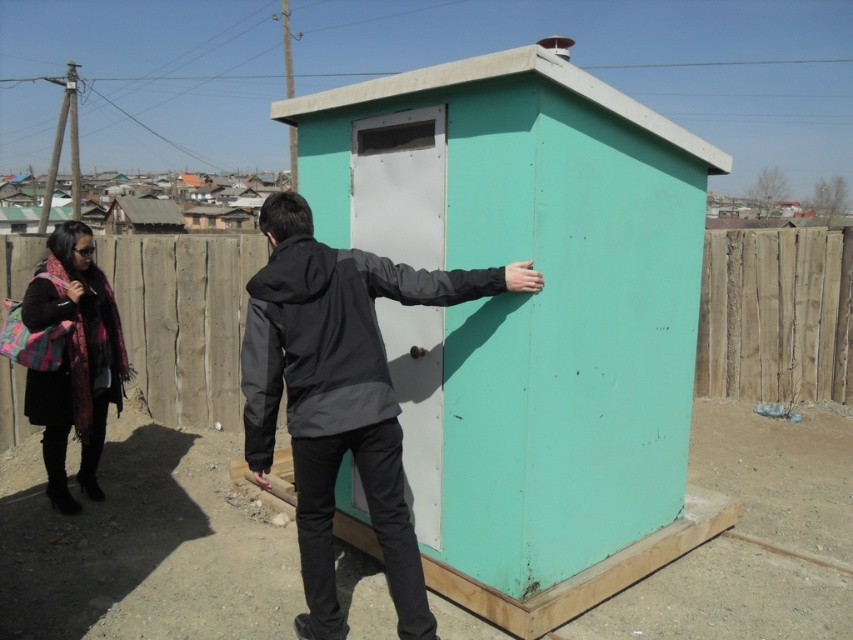
Question: Which of these objects is positioned closest to the teal matte shed at center?

Choices:
 (A) brown wooden fence at lower left
 (B) matte gray jacket at center
 (C) wooden fence at lower center
 (D) weathered wood fence at center

Answer: (B)

Question: Is matte gray jacket at center positioned before brown wooden fence at lower left?

Choices:
 (A) no
 (B) yes

Answer: (B)

Question: Which object appears closest to the camera in this image?

Choices:
 (A) matte gray jacket at center
 (B) wooden fence at lower center
 (C) teal matte shed at center
 (D) weathered wood fence at center

Answer: (A)

Question: Is the position of teal matte shed at center less distant than that of multicolored scarf at left?

Choices:
 (A) no
 (B) yes

Answer: (B)

Question: From the image, what is the correct spatial relationship of matte gray jacket at center in relation to brown wooden fence at lower left?

Choices:
 (A) below
 (B) above

Answer: (A)

Question: Estimate the real-world distances between objects in this image. Which object is closer to the brown wooden fence at lower left?

Choices:
 (A) wooden fence at lower center
 (B) multicolored scarf at left
 (C) teal matte shed at center

Answer: (A)